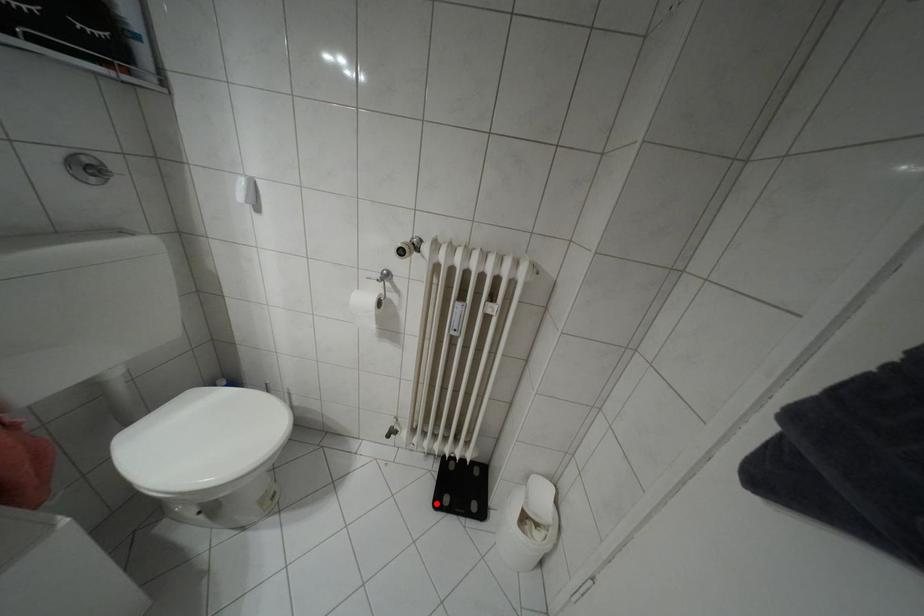
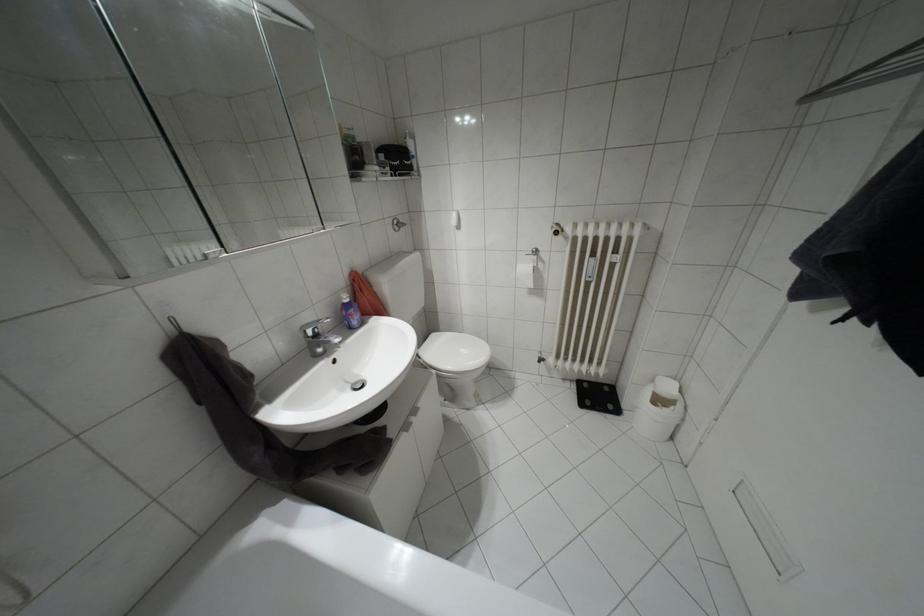
The point at the highlighted location is marked in the first image. Where is the corresponding point in the second image?

(580, 405)